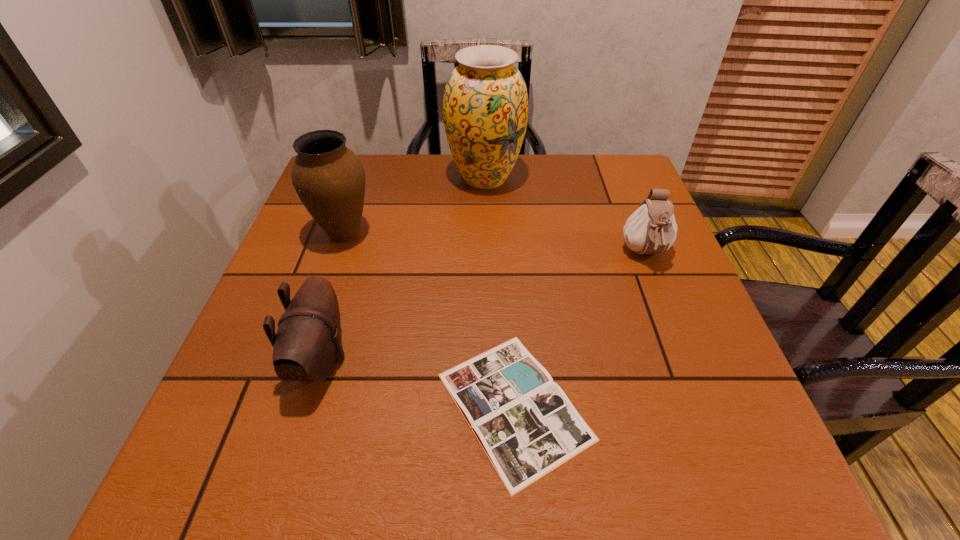
The height and width of the screenshot is (540, 960). I want to click on object identified as the closest to the left pouch, so click(525, 423).

Select which object appears as the closest to the book. Please provide its 2D coordinates. Your answer should be formatted as a tuple, i.e. [(x, y)], where the tuple contains the x and y coordinates of a point satisfying the conditions above.

[(307, 345)]

This screenshot has height=540, width=960. What are the coordinates of `free space that satisfies the following two spatial constraints: 1. on the front-facing side of the rightmost object; 2. with the flap open on the nearer pouch` in the screenshot? It's located at (686, 360).

Where is `free space that satisfies the following two spatial constraints: 1. on the front side of the vase; 2. on the left side of the shortest object`? This screenshot has height=540, width=960. free space that satisfies the following two spatial constraints: 1. on the front side of the vase; 2. on the left side of the shortest object is located at coordinates (488, 406).

I want to click on free space in the image that satisfies the following two spatial constraints: 1. on the front-facing side of the rightmost object; 2. with the flap open on the nearer pouch, so click(686, 360).

I want to click on free spot that satisfies the following two spatial constraints: 1. with the flap open on the book; 2. on the right side of the left pouch, so click(307, 406).

This screenshot has height=540, width=960. I want to click on free point that satisfies the following two spatial constraints: 1. with the flap open on the left pouch; 2. on the right side of the shortest object, so click(307, 406).